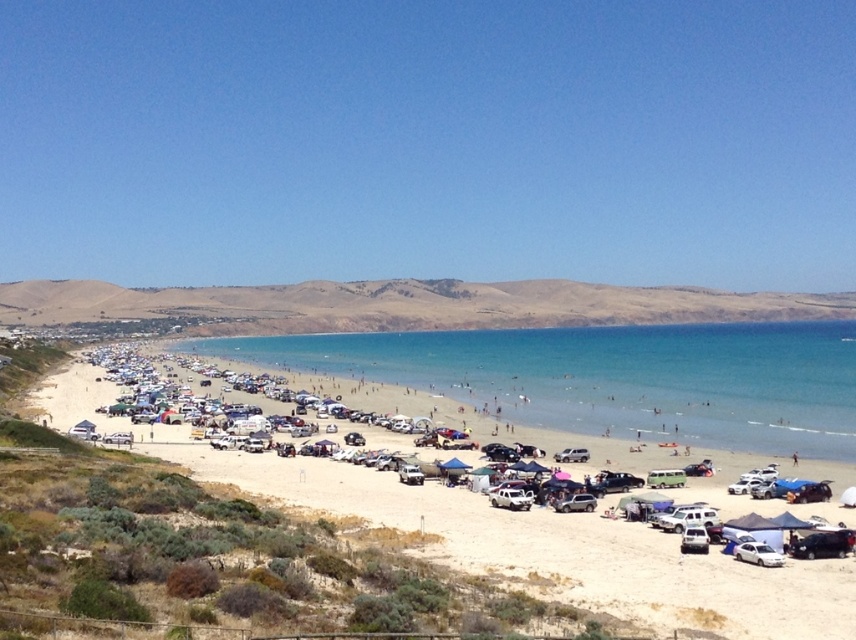
You are planning to set up a small tent on the white sand beach at lower center near the white matte car at center. Considering their sizes, which one occupies more space in the image?

The white sand beach at lower center is larger in size than the white matte car at center, so the white sand beach at lower center occupies more space in the image.

You are standing at the edge of the beach and want to reach the clear blue water at center. Which direction should you walk to get there?

The clear blue water at center is located at point coordinates, so you should walk towards the center of the beach to reach it.

You are standing on the white sand beach at lower center and want to reach the clear blue water at center. Based on the scene description, which direction should you move to get there?

You should move forward because the white sand beach at lower center is shorter than the clear blue water at center, meaning the water is further away from the viewer.